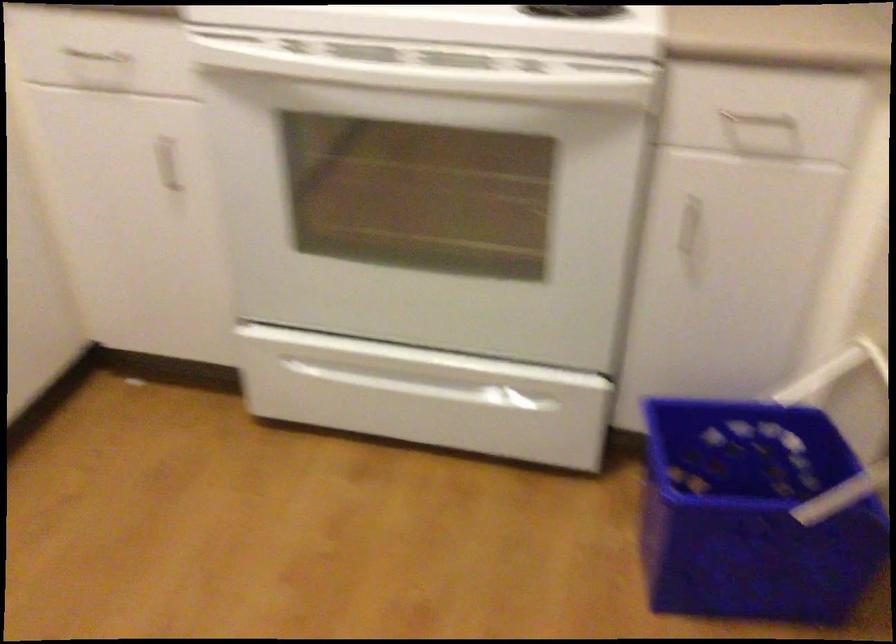
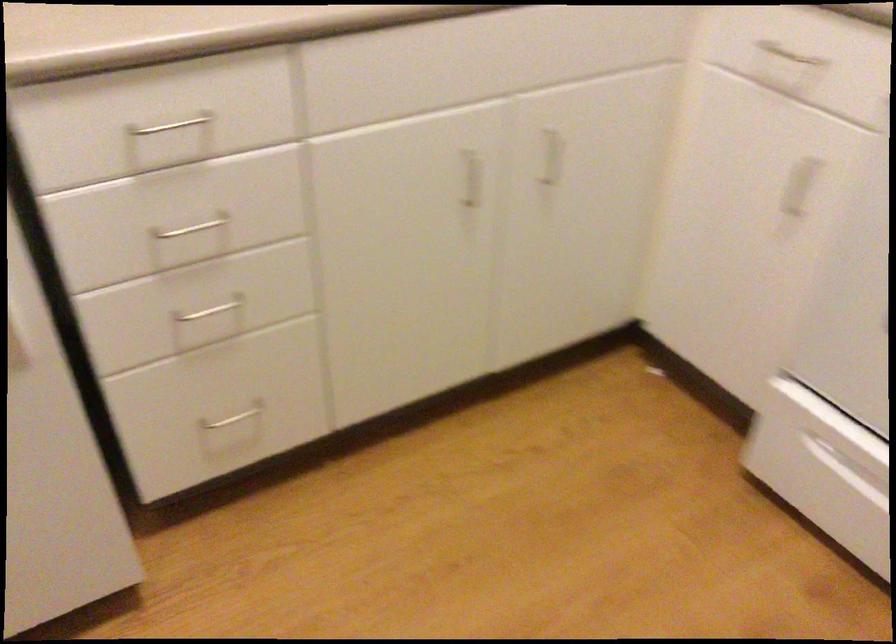
Question: The camera is either moving clockwise (left) or counter-clockwise (right) around the object. The first image is from the beginning of the video and the second image is from the end. Is the camera moving left or right when shooting the video?

Choices:
 (A) Left
 (B) Right

Answer: (B)